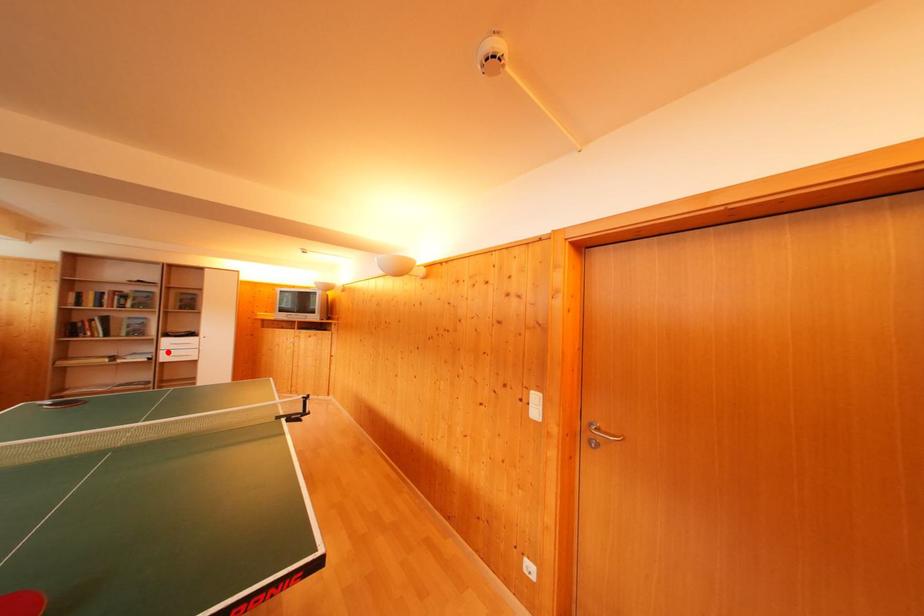
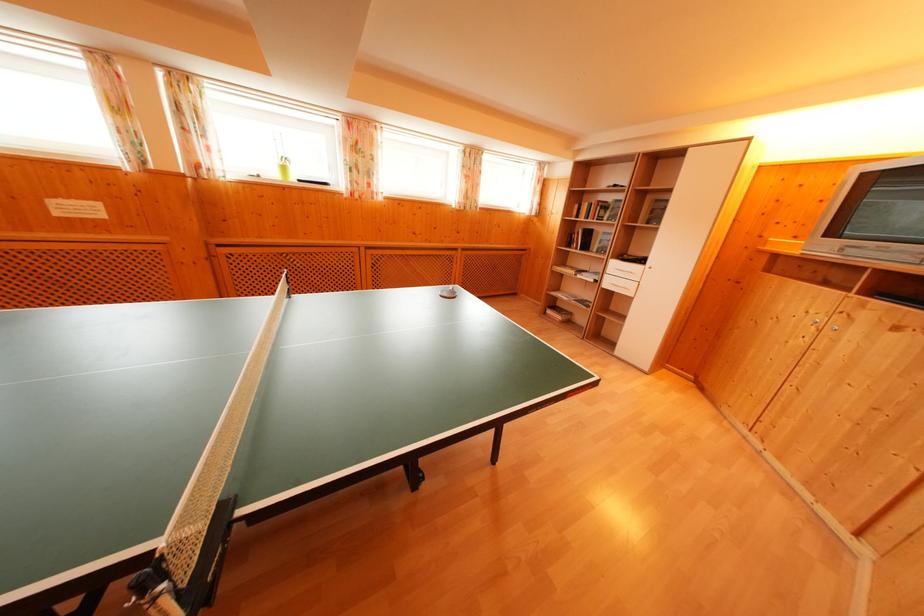
In the second image, find the point that corresponds to the highlighted location in the first image.

(614, 276)